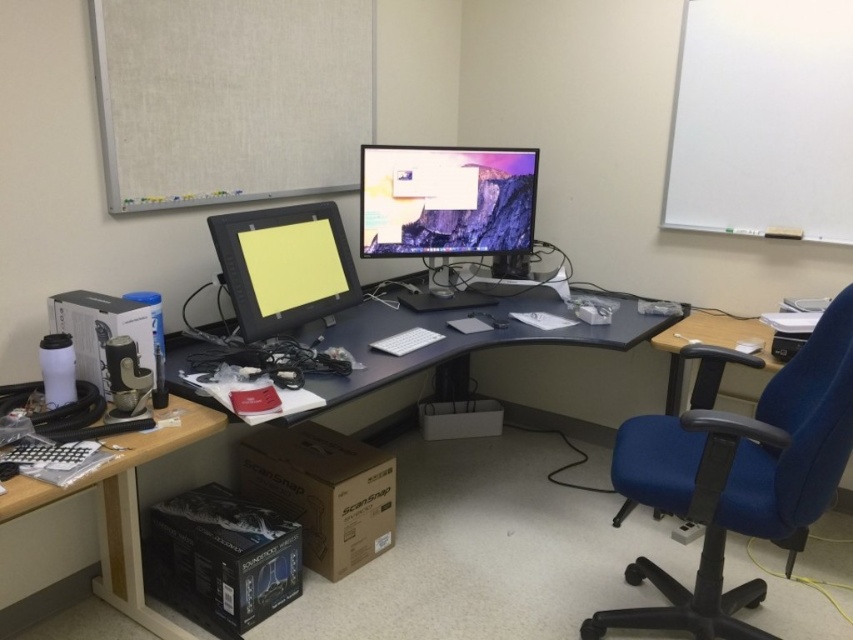
Who is shorter, satin black monitor at center or black plastic keyboard at lower left?

black plastic keyboard at lower left

Is satin black monitor at center closer to the viewer compared to black plastic keyboard at lower left?

No, satin black monitor at center is behind black plastic keyboard at lower left.

Is point (505, 177) in front of point (115, 460)?

No.

Find the location of `satin black monitor at center`. satin black monitor at center is located at coordinates (445, 209).

Image resolution: width=853 pixels, height=640 pixels. Find the location of `matte black computer desk at center`. matte black computer desk at center is located at coordinates (459, 339).

Who is more distant from viewer, (413,353) or (248,221)?

The point (413,353) is more distant.

This screenshot has height=640, width=853. I want to click on matte black computer desk at center, so click(x=459, y=339).

Between matte black monitor at center and black plastic keyboard at lower left, which one is positioned higher?

matte black monitor at center is higher up.

Is matte black monitor at center positioned behind black plastic keyboard at lower left?

Yes, matte black monitor at center is behind black plastic keyboard at lower left.

The height and width of the screenshot is (640, 853). I want to click on matte black monitor at center, so pos(283,266).